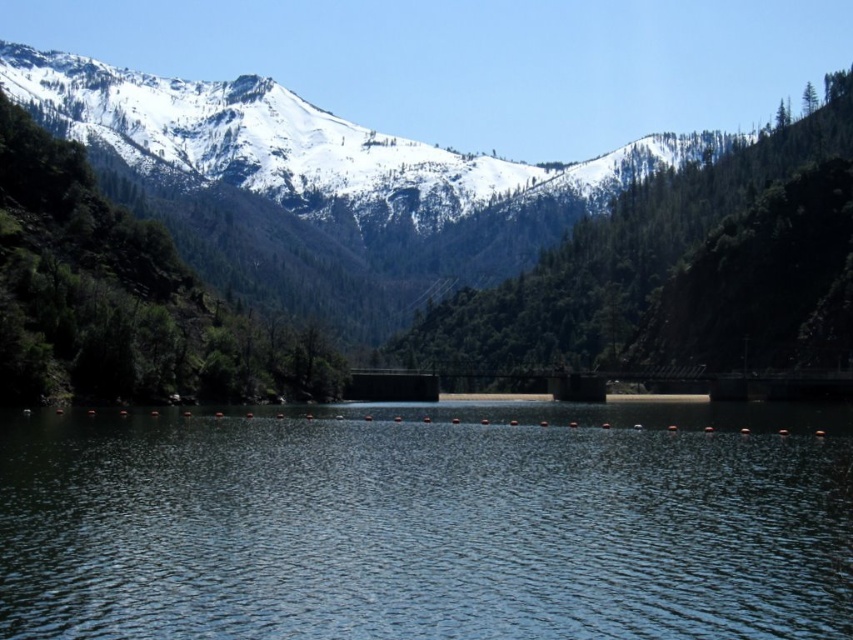
You are a hiker standing on the bridge in the image. You want to take a photo of the clear blue water at center and the green textured tree at upper center. Which object should you look down to capture in your photo?

You should look down to capture the clear blue water at center because it is positioned under the green textured tree at upper center.

You are a hiker standing on the bridge that spans the clear blue water at center. You notice the green textured tree at upper center in the distance. Which object appears taller from your viewpoint?

The green textured tree at upper center appears taller than the clear blue water at center because the description states that the clear blue water at center is shorter than the green textured tree at upper center.